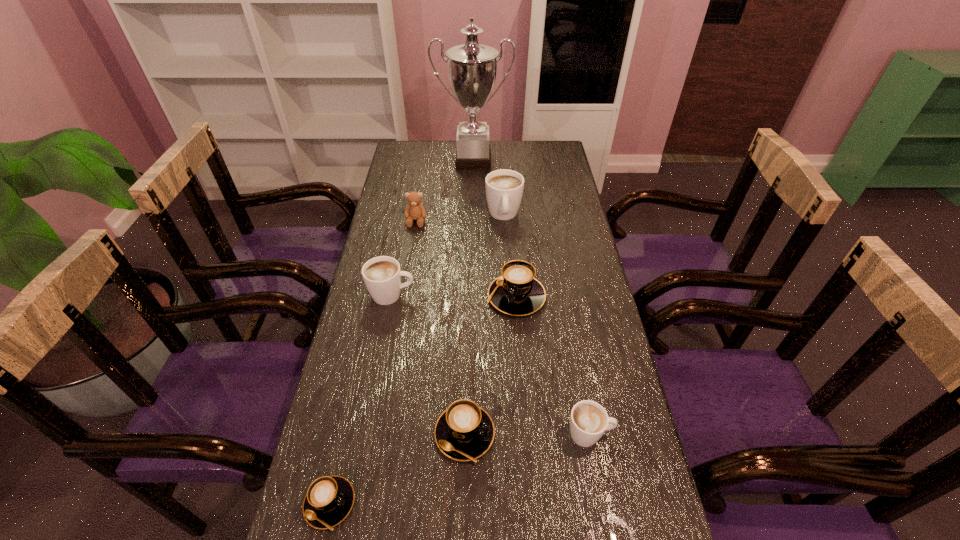
The image size is (960, 540). I want to click on the rightmost white cappuccino, so click(589, 420).

Identify the location of the leftmost black cappuccino. (329, 499).

Find the location of a particular element. The width and height of the screenshot is (960, 540). the shortest cappuccino is located at coordinates (329, 499).

Where is `free spot located 0.060m at the front view of the trophy cup`? free spot located 0.060m at the front view of the trophy cup is located at coordinates (472, 181).

Find the location of `free region located with the handle on the side of the biggest white cappuccino`. free region located with the handle on the side of the biggest white cappuccino is located at coordinates (506, 255).

Where is `blank space located on the face of the brown teddy bear`? The height and width of the screenshot is (540, 960). blank space located on the face of the brown teddy bear is located at coordinates (409, 263).

Find the location of `vacant space situated 0.190m with the handle on the side of the second farthest white cappuccino`. vacant space situated 0.190m with the handle on the side of the second farthest white cappuccino is located at coordinates (478, 295).

Locate an element on the screen. vacant area situated on the back of the biggest black cappuccino is located at coordinates [510, 223].

This screenshot has width=960, height=540. Identify the location of free space located 0.100m on the right of the second nearest black cappuccino. (538, 434).

Identify the location of free region located with the handle on the side of the nearest white cappuccino. The height and width of the screenshot is (540, 960). click(x=638, y=434).